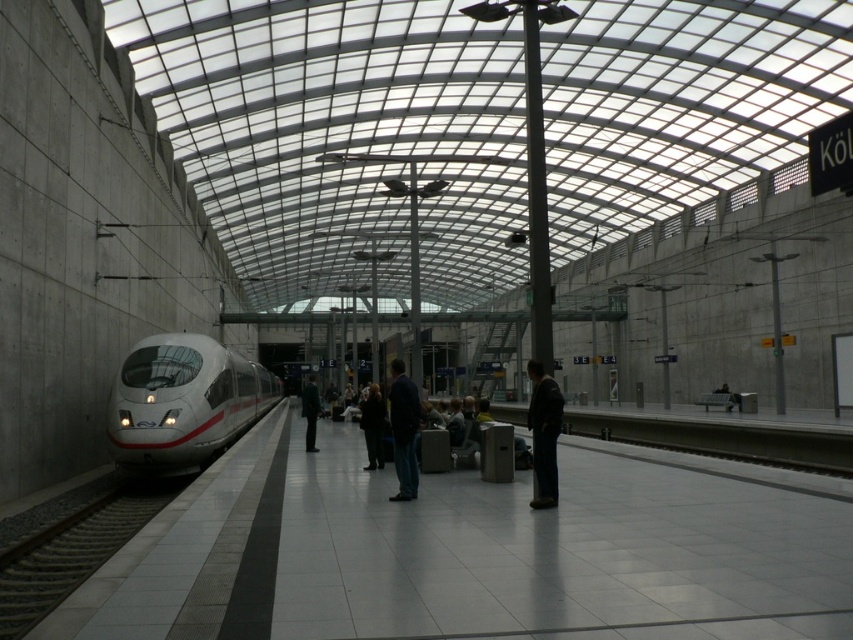
Question: Considering the relative positions of white glossy train at left and gray gravel train track at lower left in the image provided, where is white glossy train at left located with respect to gray gravel train track at lower left?

Choices:
 (A) below
 (B) above

Answer: (B)

Question: In this image, where is white glossy train at left located relative to dark blue jeans at center?

Choices:
 (A) below
 (B) above

Answer: (A)

Question: Which of these objects is positioned closest to the blue denim jeans at center?

Choices:
 (A) gray gravel train track at lower left
 (B) white glossy train at left
 (C) dark green jacket at center

Answer: (A)

Question: Which object appears closest to the camera in this image?

Choices:
 (A) dark brown leather jacket at center
 (B) dark green jacket at center
 (C) gray gravel train track at lower left
 (D) blue denim jeans at center

Answer: (C)

Question: Which of the following is the closest to the observer?

Choices:
 (A) white glossy train at left
 (B) blue denim jeans at center
 (C) dark brown leather jacket at center

Answer: (B)

Question: In this image, where is dark brown leather jacket at center located relative to dark green jacket at center?

Choices:
 (A) right
 (B) left

Answer: (A)